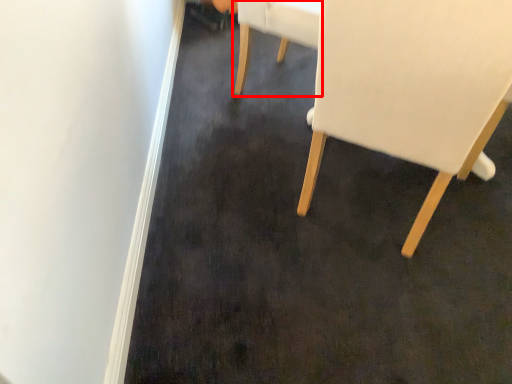
Question: From the image's perspective, where is chair (annotated by the red box) located in relation to chair in the image?

Choices:
 (A) above
 (B) below

Answer: (A)